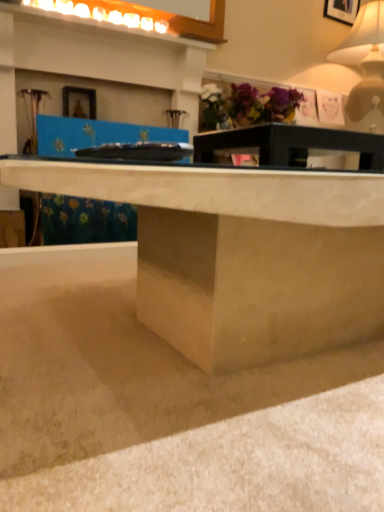
Question: Is matte white table lamp at upper right facing towards matte concrete desk at center?

Choices:
 (A) yes
 (B) no

Answer: (B)

Question: Considering the relative sizes of matte white table lamp at upper right and matte concrete desk at center in the image provided, is matte white table lamp at upper right smaller than matte concrete desk at center?

Choices:
 (A) no
 (B) yes

Answer: (B)

Question: Is matte white table lamp at upper right touching matte concrete desk at center?

Choices:
 (A) no
 (B) yes

Answer: (A)

Question: Are matte white table lamp at upper right and matte concrete desk at center located far from each other?

Choices:
 (A) yes
 (B) no

Answer: (A)

Question: Would you say matte white table lamp at upper right contains matte concrete desk at center?

Choices:
 (A) no
 (B) yes

Answer: (A)

Question: Based on their sizes in the image, would you say matte white table lamp at upper right is bigger or smaller than smooth concrete at lower center?

Choices:
 (A) big
 (B) small

Answer: (A)

Question: Considering the positions of matte white table lamp at upper right and smooth concrete at lower center in the image, is matte white table lamp at upper right wider or thinner than smooth concrete at lower center?

Choices:
 (A) wide
 (B) thin

Answer: (B)

Question: Considering the positions of matte white table lamp at upper right and smooth concrete at lower center in the image, is matte white table lamp at upper right taller or shorter than smooth concrete at lower center?

Choices:
 (A) tall
 (B) short

Answer: (A)

Question: From the image's perspective, relative to smooth concrete at lower center, is matte white table lamp at upper right above or below?

Choices:
 (A) below
 (B) above

Answer: (B)

Question: From a real-world perspective, is smooth concrete at lower center above or below matte purple flowers at upper center?

Choices:
 (A) below
 (B) above

Answer: (A)

Question: Which is correct: smooth concrete at lower center is inside matte purple flowers at upper center, or outside of it?

Choices:
 (A) inside
 (B) outside

Answer: (B)

Question: Is point (347, 390) closer or farther from the camera than point (253, 120)?

Choices:
 (A) farther
 (B) closer

Answer: (B)

Question: In terms of width, does smooth concrete at lower center look wider or thinner when compared to matte purple flowers at upper center?

Choices:
 (A) thin
 (B) wide

Answer: (B)

Question: From a real-world perspective, relative to matte concrete desk at center, is matte black table at center vertically above or below?

Choices:
 (A) above
 (B) below

Answer: (A)

Question: Do you think matte black table at center is within matte concrete desk at center, or outside of it?

Choices:
 (A) inside
 (B) outside

Answer: (B)